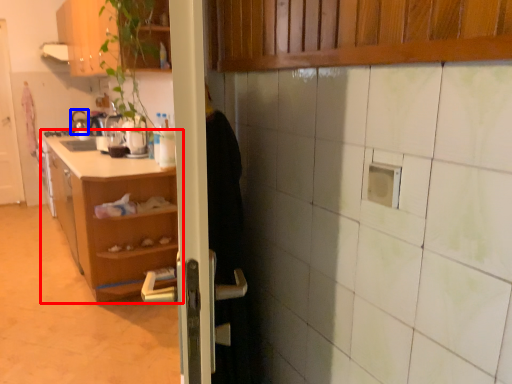
Question: Which of the following is the farthest to the observer, shelf (highlighted by a red box) or appliance (highlighted by a blue box)?

Choices:
 (A) shelf
 (B) appliance

Answer: (B)